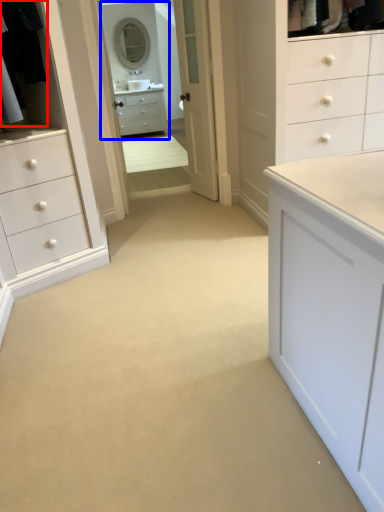
Question: Which of the following is the closest to the observer, laundry (highlighted by a red box) or mirror (highlighted by a blue box)?

Choices:
 (A) laundry
 (B) mirror

Answer: (A)